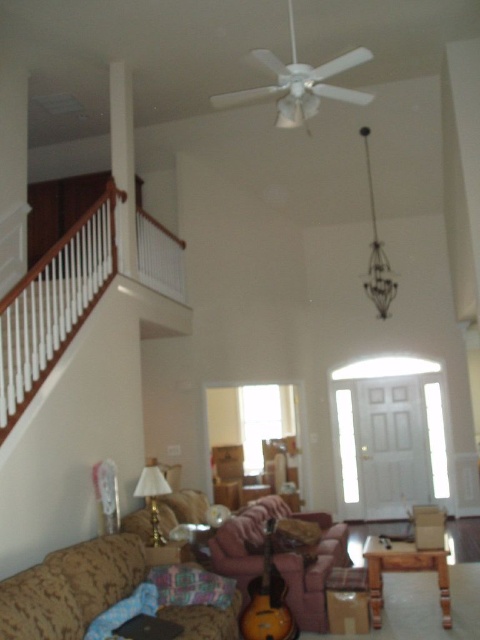
You are a delivery person trying to place a new rectangular package that is 12 inches wide between the sunburst wood guitar at lower center and the velvet pink pillow at lower center. Based on the space between them, will the package fit horizontally?

The sunburst wood guitar at lower center is thinner than the velvet pink pillow at lower center. Since the package is 12 inches wide, and the space between the two objects is wider than the thinner object, the package should fit horizontally between them.

You are standing in the living room and want to place a small plant between the two points marked as point [328,525] and point [163,564]. Since the plant needs to be closer to the camera, which point should you position it near?

To place the plant closer to the camera, you should position it near point [328,525] because it is further to the camera than point [163,564].

You are a guest in this living room and want to sit on the velvet pink pillow at lower center. Can you sit directly on it without moving the sunburst wood guitar at lower center?

The velvet pink pillow at lower center is behind the sunburst wood guitar at lower center, so you cannot sit directly on it without moving the guitar first.